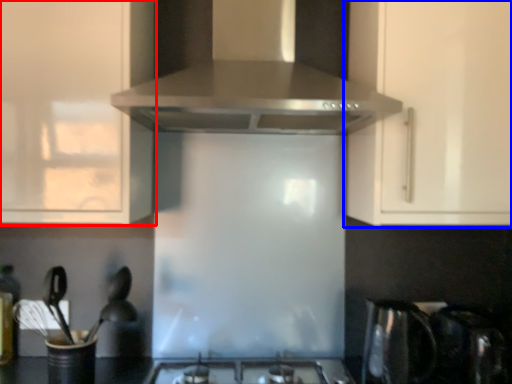
Question: Which point is further to the camera, cabinetry (highlighted by a red box) or cabinetry (highlighted by a blue box)?

Choices:
 (A) cabinetry
 (B) cabinetry

Answer: (B)